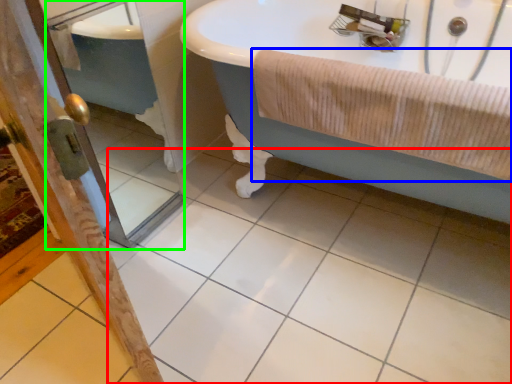
Question: Which object is positioned closest to ceramic tile (highlighted by a red box)? Select from bath towel (highlighted by a blue box) and screen door (highlighted by a green box).

Choices:
 (A) bath towel
 (B) screen door

Answer: (A)